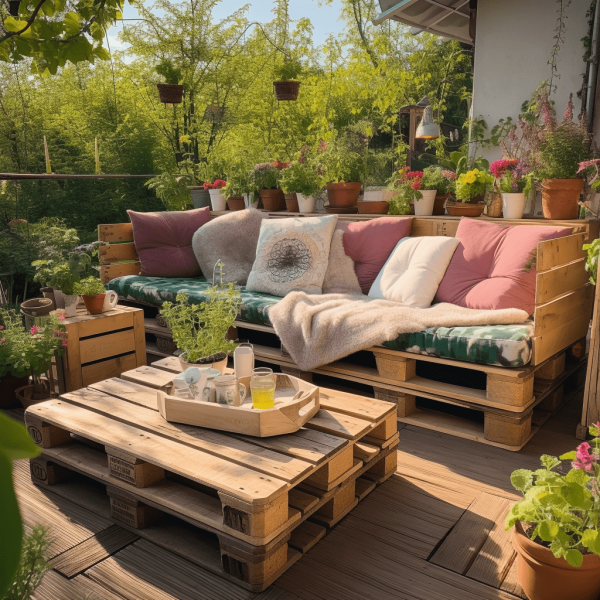
Where is `white square throw pillow`? This screenshot has height=600, width=600. white square throw pillow is located at coordinates (414, 264).